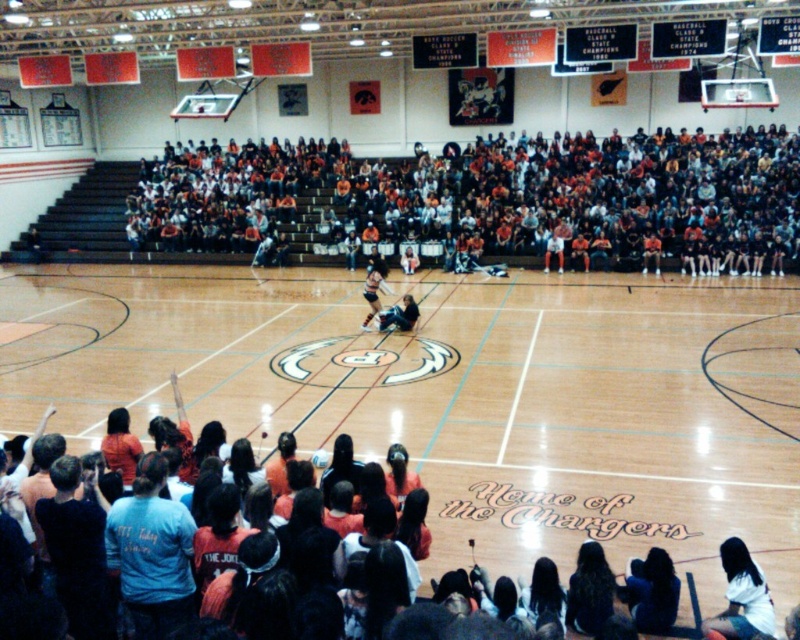
Question: Which object is farther from the camera taking this photo?

Choices:
 (A) orange jersey at center
 (B) white cotton shirt at lower right
 (C) white fabric shirt at center
 (D) orange casual clothing at upper center

Answer: (C)

Question: From the image, what is the correct spatial relationship of white cotton shirt at lower right in relation to white fabric shirt at center?

Choices:
 (A) left
 (B) right

Answer: (A)

Question: Which point is farther from the camera taking this photo?

Choices:
 (A) (376, 257)
 (B) (620, 156)
 (C) (544, 262)
 (D) (766, 632)

Answer: (B)

Question: In this image, where is orange casual clothing at upper center located relative to white cotton shirt at lower right?

Choices:
 (A) left
 (B) right

Answer: (A)

Question: Which point appears closest to the camera in this image?

Choices:
 (A) (356, 176)
 (B) (406, 330)

Answer: (B)

Question: Can you confirm if orange casual clothing at upper center is wider than orange jersey at center?

Choices:
 (A) yes
 (B) no

Answer: (A)